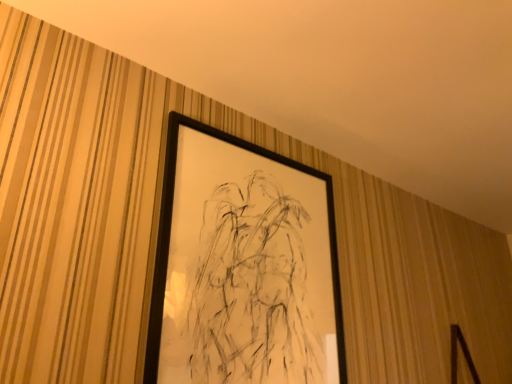
Find the location of a particular element. This screenshot has height=384, width=512. black matte picture frame at upper center is located at coordinates (243, 267).

Describe the element at coordinates (243, 267) in the screenshot. I see `black matte picture frame at upper center` at that location.

The image size is (512, 384). Find the location of `black matte picture frame at upper center`. black matte picture frame at upper center is located at coordinates (243, 267).